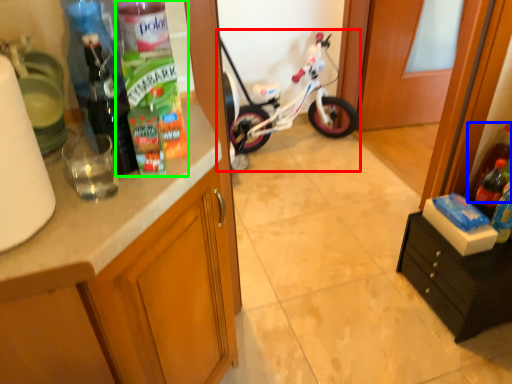
Question: Which is farther away from bicycle (highlighted by a red box)? bottle (highlighted by a blue box) or bottle (highlighted by a green box)?

Choices:
 (A) bottle
 (B) bottle

Answer: (B)